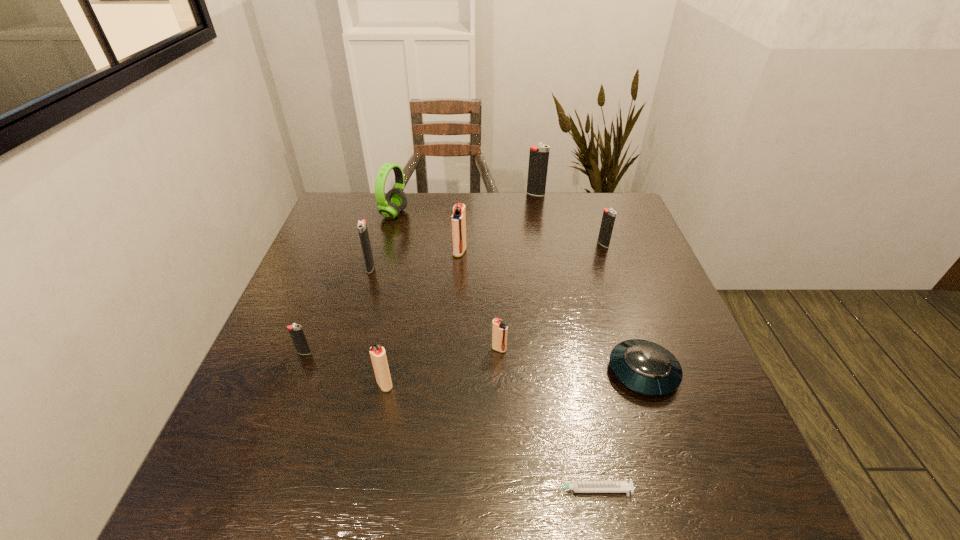
The height and width of the screenshot is (540, 960). What are the coordinates of `free space at the left edge of the desktop` in the screenshot? It's located at (321, 245).

You are a GUI agent. You are given a task and a screenshot of the screen. Output one action in this format:
    pyautogui.click(x=<x>, y=<y>)
    Task: Click on the vacant area at the right edge
    The width and height of the screenshot is (960, 540).
    Given the screenshot: What is the action you would take?
    pyautogui.click(x=656, y=403)

Locate an element on the screen. free point between the farthest igniter and the fourth object from left to right is located at coordinates (460, 289).

Identify the location of free point between the sixth object from right to left and the white syringe. (523, 371).

In order to click on free area in between the white syringe and the second farthest black igniter in this screenshot , I will do `click(595, 367)`.

Locate an element on the screen. The height and width of the screenshot is (540, 960). empty space between the farthest black igniter and the white syringe is located at coordinates (562, 342).

Where is `free point between the fifth igniter from left to right and the fifth igniter from right to left`? free point between the fifth igniter from left to right and the fifth igniter from right to left is located at coordinates (442, 367).

You are a GUI agent. You are given a task and a screenshot of the screen. Output one action in this format:
    pyautogui.click(x=<x>, y=<y>)
    Task: Click on the free space between the second smallest black igniter and the saucer
    This screenshot has width=960, height=540.
    Given the screenshot: What is the action you would take?
    pyautogui.click(x=623, y=308)

You are a GUI agent. You are given a task and a screenshot of the screen. Output one action in this format:
    pyautogui.click(x=<x>, y=<y>)
    Task: Click on the free space between the biggest black igniter and the shortest object
    The image size is (960, 540).
    Given the screenshot: What is the action you would take?
    pyautogui.click(x=562, y=342)

At what (x,y) coordinates should I click in order to perform the action: click on vacant point located between the second black igniter from right to left and the fifth object from right to left. Please return your answer as a coordinate pair (x, y). The width and height of the screenshot is (960, 540). Looking at the image, I should click on (517, 272).